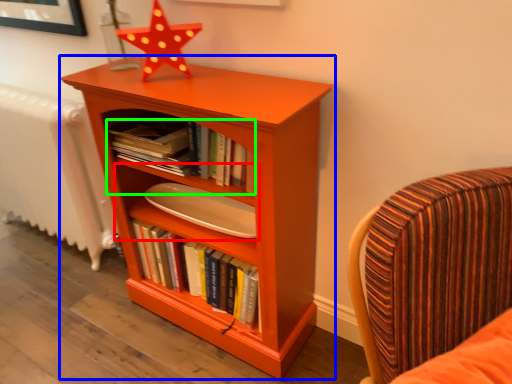
Question: Which object is positioned farthest from shelf (highlighted by a red box)? Select from bookcase (highlighted by a blue box) and book (highlighted by a green box).

Choices:
 (A) bookcase
 (B) book

Answer: (A)